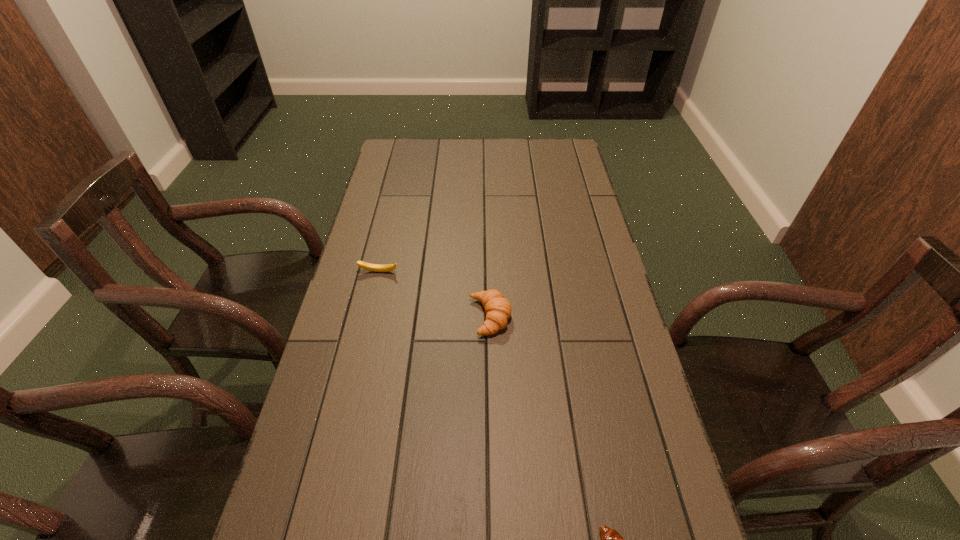
The image size is (960, 540). What are the coordinates of `the left crescent roll` in the screenshot? It's located at (498, 309).

Image resolution: width=960 pixels, height=540 pixels. In order to click on the tallest object in this screenshot , I will do `click(498, 309)`.

Locate an element on the screen. the farthest object is located at coordinates (368, 266).

In order to click on banana in this screenshot , I will do `click(368, 266)`.

The image size is (960, 540). Find the location of `vacant area situated on the right of the tallest object`. vacant area situated on the right of the tallest object is located at coordinates (553, 317).

The height and width of the screenshot is (540, 960). I want to click on vacant position located 0.050m at the stem of the farthest object, so click(x=375, y=287).

This screenshot has width=960, height=540. Find the location of `object at the left edge`. object at the left edge is located at coordinates (368, 266).

Locate an element on the screen. free space at the far edge is located at coordinates (460, 147).

You are a GUI agent. You are given a task and a screenshot of the screen. Output one action in this format:
    pyautogui.click(x=<x>, y=<y>)
    Task: Click on the vacant point at the left edge
    This screenshot has width=960, height=540.
    Given the screenshot: What is the action you would take?
    pyautogui.click(x=395, y=192)

The width and height of the screenshot is (960, 540). In the image, there is a desktop. In order to click on vacant region at the right edge in this screenshot , I will do (570, 231).